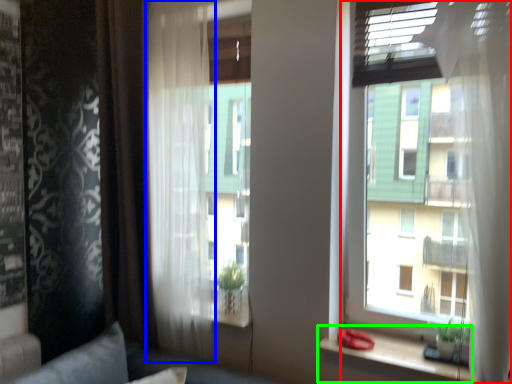
Question: Based on their relative distances, which object is nearer to window (highlighted by a red box)? Choose from curtain (highlighted by a blue box) and window sill (highlighted by a green box).

Choices:
 (A) curtain
 (B) window sill

Answer: (B)